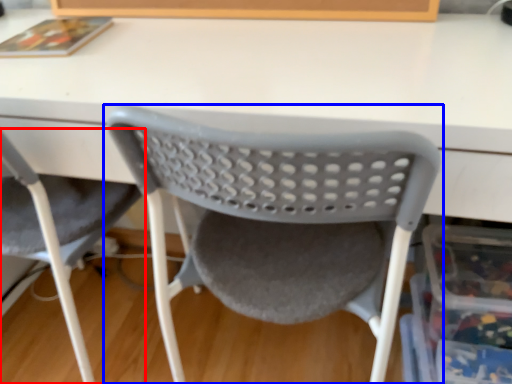
Question: Which of the following is the closest to the observer, chair (highlighted by a red box) or chair (highlighted by a blue box)?

Choices:
 (A) chair
 (B) chair

Answer: (B)